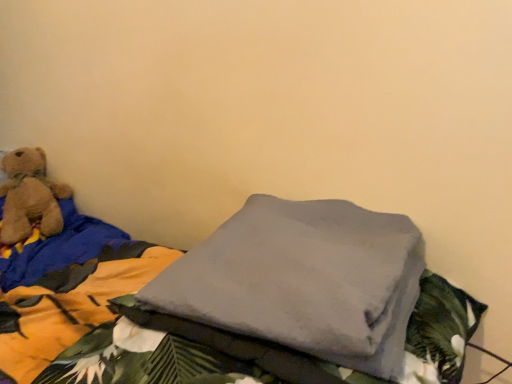
Question: Is gray fleece blanket at center in front of or behind soft brown teddy bear at left in the image?

Choices:
 (A) front
 (B) behind

Answer: (A)

Question: Is gray fleece blanket at center situated inside soft brown teddy bear at left or outside?

Choices:
 (A) inside
 (B) outside

Answer: (B)

Question: From a real-world perspective, is gray fleece blanket at center positioned above or below soft brown teddy bear at left?

Choices:
 (A) above
 (B) below

Answer: (B)

Question: Considering the positions of point (19, 238) and point (257, 354), is point (19, 238) closer or farther from the camera than point (257, 354)?

Choices:
 (A) closer
 (B) farther

Answer: (B)

Question: In terms of width, does soft brown teddy bear at left look wider or thinner when compared to gray fleece blanket at center?

Choices:
 (A) wide
 (B) thin

Answer: (B)

Question: Relative to gray fleece blanket at center, is soft brown teddy bear at left in front or behind?

Choices:
 (A) behind
 (B) front

Answer: (A)

Question: In the image, is soft brown teddy bear at left on the left side or the right side of gray fleece blanket at center?

Choices:
 (A) right
 (B) left

Answer: (B)